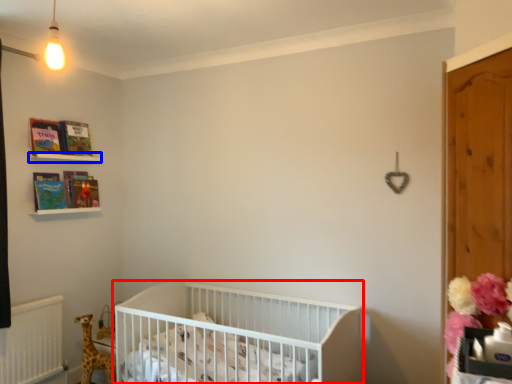
Question: Among these objects, which one is nearest to the camera, infant bed (highlighted by a red box) or balustrade (highlighted by a blue box)?

Choices:
 (A) infant bed
 (B) balustrade

Answer: (A)